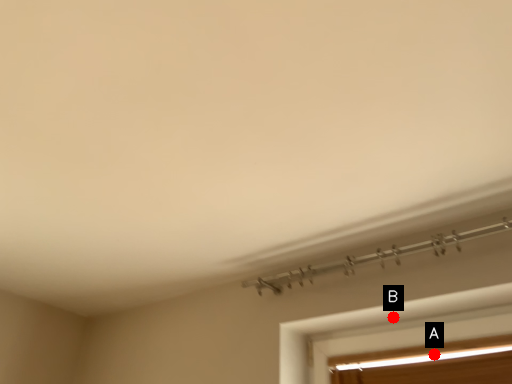
Question: Two points are circled on the image, labeled by A and B beside each circle. Which point is farther from the camera taking this photo?

Choices:
 (A) A is further
 (B) B is further

Answer: (B)